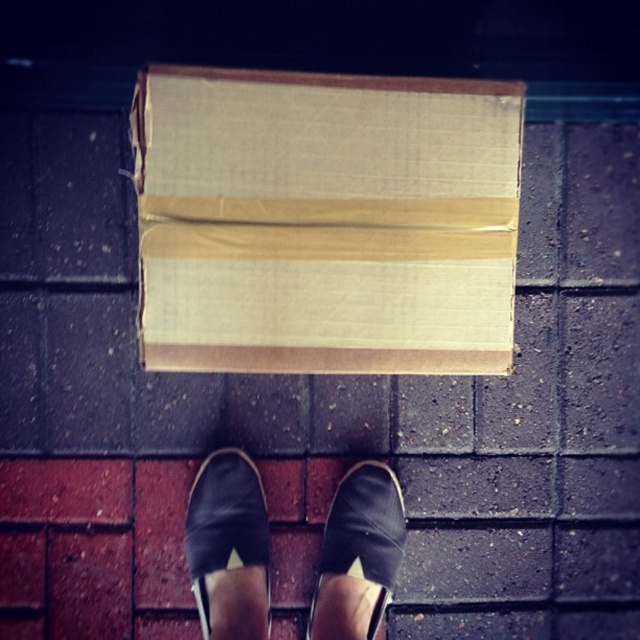
You are trying to determine if the brown cardboard box at center can fit entirely within the space between the black canvas shoe at center and the nearest wall. Is there enough space?

The brown cardboard box at center might be wider than black canvas shoe at center, so it depends on the distance between the shoe and the wall. If the space is wider than the box, it can fit, otherwise not.

You are trying to determine the exact position of the black leather shoe at center in the image. What are the coordinates of its location?

The coordinates of the black leather shoe at center are at point (358, 554).